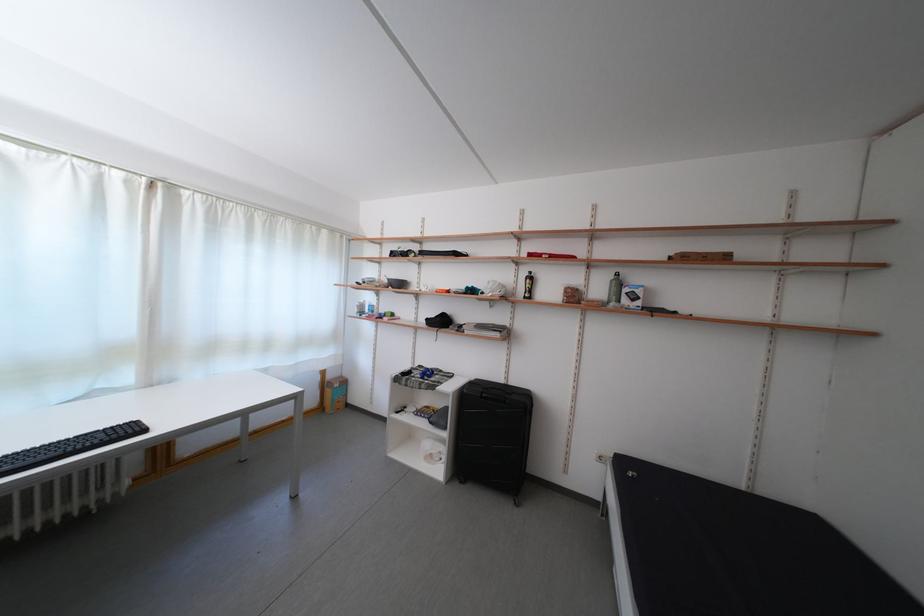
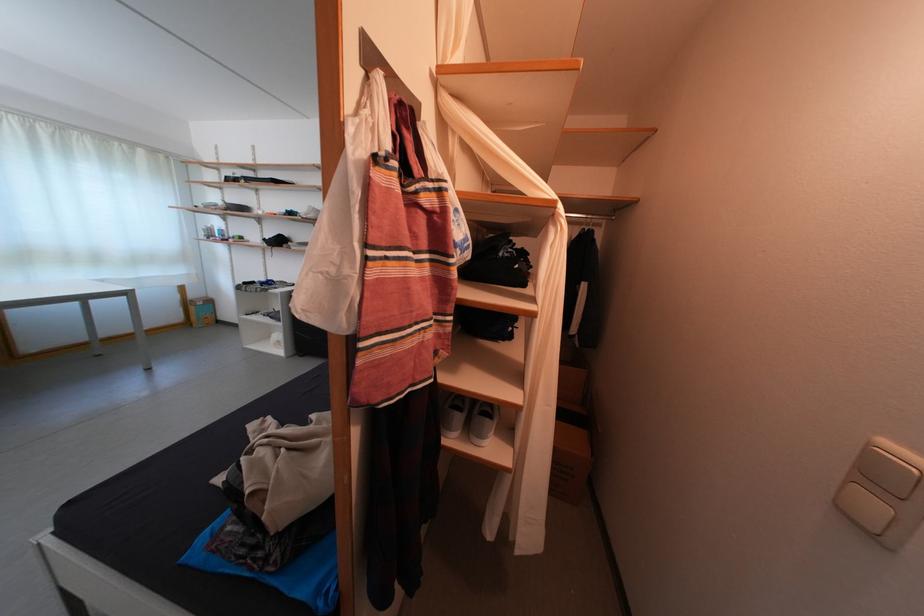
Where in the second image is the point corresponding to point 338,382 from the first image?

(201, 302)